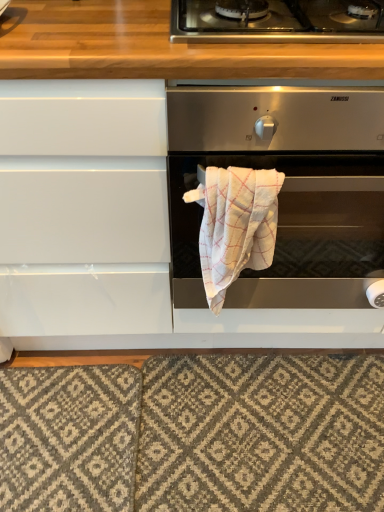
Measure the distance between white textured towel at center and camera.

The distance of white textured towel at center from camera is 77.47 centimeters.

You are a GUI agent. You are given a task and a screenshot of the screen. Output one action in this format:
    pyautogui.click(x=<x>, y=<y>)
    Task: Click on the textured gray rug at lower center
    This screenshot has width=384, height=512.
    Given the screenshot: What is the action you would take?
    pyautogui.click(x=261, y=433)

This screenshot has width=384, height=512. In order to click on satin silver oven at center in this screenshot , I will do `click(285, 188)`.

How different are the orientations of satin silver oven at center and white textured towel at center in degrees?

0.00192 degrees separate the facing orientations of satin silver oven at center and white textured towel at center.

Considering the relative sizes of satin silver oven at center and white textured towel at center in the image provided, is satin silver oven at center shorter than white textured towel at center?

Incorrect, the height of satin silver oven at center does not fall short of that of white textured towel at center.

From the image's perspective, is satin silver oven at center under white textured towel at center?

No, from the image's perspective, satin silver oven at center is not below white textured towel at center.

Looking at this image, visually, is satin silver oven at center positioned to the left or to the right of white textured towel at center?

In the image, satin silver oven at center appears on the right side of white textured towel at center.

Is white textured towel at center wider or thinner than textured gray rug at lower center?

Clearly, white textured towel at center has less width compared to textured gray rug at lower center.

Which is closer to the camera, (229, 192) or (374, 467)?

The point (229, 192) is closer to the camera.

From a real-world perspective, relative to textured gray rug at lower center, is white textured towel at center vertically above or below?

white textured towel at center is above textured gray rug at lower center.

From the image's perspective, relative to textured gray rug at lower center, is white textured towel at center above or below?

From the image's perspective, white textured towel at center appears above textured gray rug at lower center.

Is textured gray rug at lower center not inside white textured towel at center?

textured gray rug at lower center lies outside white textured towel at center's area.

In the image, is textured gray rug at lower center positioned in front of or behind white textured towel at center?

Visually, textured gray rug at lower center is located behind white textured towel at center.

Does textured gray rug at lower center turn towards white textured towel at center?

No, textured gray rug at lower center is not aimed at white textured towel at center.

From the image's perspective, is white textured towel at center above or below satin silver oven at center?

white textured towel at center is situated lower than satin silver oven at center in the image.

Who is shorter, white textured towel at center or satin silver oven at center?

white textured towel at center.

Does white textured towel at center touch satin silver oven at center?

No, white textured towel at center is not with satin silver oven at center.

How much distance is there between white textured towel at center and satin silver oven at center?

white textured towel at center and satin silver oven at center are 4.63 inches apart from each other.

Consider the image. Is satin silver oven at center not inside textured gray rug at lower center?

Yes, satin silver oven at center is outside of textured gray rug at lower center.

Is satin silver oven at center aimed at textured gray rug at lower center?

No.

Are satin silver oven at center and textured gray rug at lower center making contact?

No, satin silver oven at center is not beside textured gray rug at lower center.

In the scene shown: Which of these two, satin silver oven at center or textured gray rug at lower center, is smaller?

textured gray rug at lower center.

Consider the image. Considering their positions, is stainless steel gas stove at upper center located in front of or behind white textured towel at center?

In the image, stainless steel gas stove at upper center appears in front of white textured towel at center.

Consider the image. Between stainless steel gas stove at upper center and white textured towel at center, which one has larger width?

stainless steel gas stove at upper center is wider.

Are stainless steel gas stove at upper center and white textured towel at center located far from each other?

Actually, stainless steel gas stove at upper center and white textured towel at center are a little close together.

Which point is more distant from viewer, (215, 25) or (267, 222)?

Positioned behind is point (267, 222).

Are satin silver oven at center and stainless steel gas stove at upper center far apart?

No, there isn't a large distance between satin silver oven at center and stainless steel gas stove at upper center.

Can we say satin silver oven at center lies outside stainless steel gas stove at upper center?

Yes.

How different are the orientations of satin silver oven at center and stainless steel gas stove at upper center in degrees?

The angular difference between satin silver oven at center and stainless steel gas stove at upper center is 0.734 degrees.

Identify the location of oven above the white textured towel at center (from the image's perspective). (285, 188).

Identify the location of bath towel above the textured gray rug at lower center (from a real-world perspective). (236, 225).

Considering their positions, is white textured towel at center positioned closer to satin silver oven at center than stainless steel gas stove at upper center?

white textured towel at center is closer to satin silver oven at center.

When comparing their distances from textured gray rug at lower center, does white textured towel at center or stainless steel gas stove at upper center seem further?

stainless steel gas stove at upper center is further to textured gray rug at lower center.

Based on their spatial positions, is stainless steel gas stove at upper center or textured gray rug at lower center closer to satin silver oven at center?

stainless steel gas stove at upper center.

Based on their spatial positions, is textured gray rug at lower center or white textured towel at center closer to stainless steel gas stove at upper center?

white textured towel at center lies closer to stainless steel gas stove at upper center than the other object.

When comparing their distances from stainless steel gas stove at upper center, does satin silver oven at center or textured gray rug at lower center seem further?

textured gray rug at lower center is positioned further to the anchor stainless steel gas stove at upper center.

Based on their spatial positions, is satin silver oven at center or textured gray rug at lower center closer to white textured towel at center?

Based on the image, satin silver oven at center appears to be nearer to white textured towel at center.

When comparing their distances from stainless steel gas stove at upper center, does white textured towel at center or satin silver oven at center seem closer?

satin silver oven at center is closer to stainless steel gas stove at upper center.

Considering their positions, is textured gray rug at lower center positioned closer to white textured towel at center than satin silver oven at center?

satin silver oven at center lies closer to white textured towel at center than the other object.

At what (x,y) coordinates should I click in order to perform the action: click on oven between stainless steel gas stove at upper center and textured gray rug at lower center vertically. Please return your answer as a coordinate pair (x, y). The height and width of the screenshot is (512, 384). Looking at the image, I should click on (285, 188).

Locate an element on the screen. bath towel between stainless steel gas stove at upper center and textured gray rug at lower center from top to bottom is located at coordinates (236, 225).

I want to click on bath towel between satin silver oven at center and textured gray rug at lower center from top to bottom, so click(x=236, y=225).

Find the location of a particular element. The width and height of the screenshot is (384, 512). oven between stainless steel gas stove at upper center and white textured towel at center in the vertical direction is located at coordinates (285, 188).